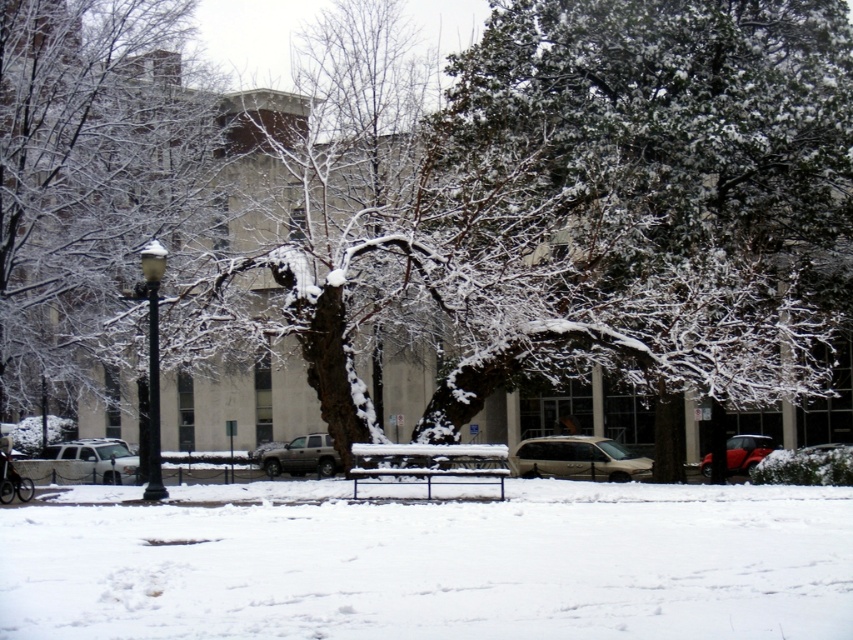
Question: Estimate the real-world distances between objects in this image. Which object is farther from the silver metallic suv at center?

Choices:
 (A) shiny red car at lower right
 (B) metallic silver suv at center
 (C) metallic blue bench at center

Answer: (C)

Question: Is metallic silver suv at center below white matte suv at lower left?

Choices:
 (A) no
 (B) yes

Answer: (A)

Question: Is black polished metal lamp post at left wider than white matte suv at lower left?

Choices:
 (A) no
 (B) yes

Answer: (A)

Question: Does metallic blue bench at center appear under black polished metal lamp post at left?

Choices:
 (A) yes
 (B) no

Answer: (A)

Question: Which object is farther from the camera taking this photo?

Choices:
 (A) snow-covered tree at left
 (B) shiny red car at lower right

Answer: (B)

Question: Which object is closer to the camera taking this photo?

Choices:
 (A) shiny red car at lower right
 (B) black polished metal lamp post at left
 (C) silver metallic suv at center
 (D) white matte suv at lower left

Answer: (B)